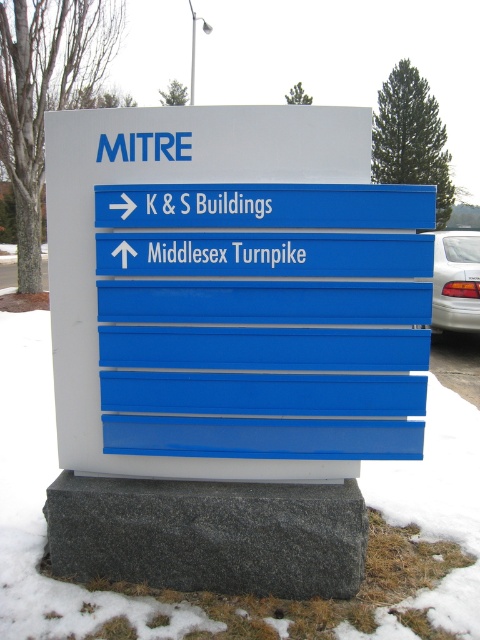
Question: Is blue plastic sign at center closer to the viewer compared to white glossy sedan at right?

Choices:
 (A) no
 (B) yes

Answer: (B)

Question: Does blue plastic sign at center appear on the right side of white glossy sedan at right?

Choices:
 (A) no
 (B) yes

Answer: (A)

Question: Which point is farther to the camera?

Choices:
 (A) blue plastic sign at center
 (B) white glossy sedan at right

Answer: (B)

Question: Is blue plastic sign at center above white glossy sedan at right?

Choices:
 (A) yes
 (B) no

Answer: (B)